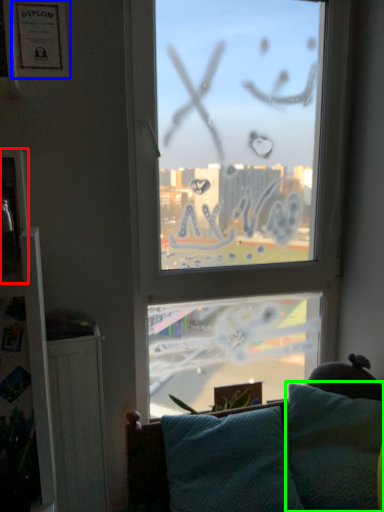
Question: Which is nearer to the picture frame (highlighted by a red box)? picture frame (highlighted by a blue box) or pillow (highlighted by a green box).

Choices:
 (A) picture frame
 (B) pillow

Answer: (A)